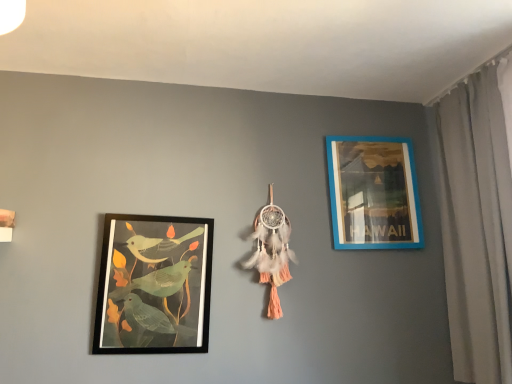
Question: From the image's perspective, is white fabric curtain at right on top of blue plastic picture frame at upper right, arranged as the first picture frame when viewed from the right?

Choices:
 (A) no
 (B) yes

Answer: (A)

Question: Is white fabric curtain at right facing away from blue plastic picture frame at upper right, which appears as the first picture frame when viewed from the back?

Choices:
 (A) no
 (B) yes

Answer: (A)

Question: Can you confirm if white fabric curtain at right is bigger than blue plastic picture frame at upper right, arranged as the first picture frame when viewed from the right?

Choices:
 (A) yes
 (B) no

Answer: (A)

Question: Is white fabric curtain at right far from blue plastic picture frame at upper right, which is counted as the 2th picture frame, starting from the left?

Choices:
 (A) yes
 (B) no

Answer: (B)

Question: Considering the relative sizes of white fabric curtain at right and blue plastic picture frame at upper right, which is counted as the 2th picture frame, starting from the left, in the image provided, is white fabric curtain at right thinner than blue plastic picture frame at upper right, which is counted as the 2th picture frame, starting from the left,?

Choices:
 (A) no
 (B) yes

Answer: (A)

Question: Can you confirm if white fabric curtain at right is taller than blue plastic picture frame at upper right, which appears as the first picture frame when viewed from the back?

Choices:
 (A) no
 (B) yes

Answer: (B)

Question: From the image's perspective, is blue plastic picture frame at upper right, arranged as the first picture frame when viewed from the right, located beneath matte black picture frame at left, which ranks as the first picture frame in front-to-back order?

Choices:
 (A) no
 (B) yes

Answer: (A)

Question: Is blue plastic picture frame at upper right, arranged as the first picture frame when viewed from the right, wider than matte black picture frame at left, the second picture frame in the back-to-front sequence?

Choices:
 (A) yes
 (B) no

Answer: (B)

Question: Is blue plastic picture frame at upper right, which is counted as the 2th picture frame, starting from the left, far from matte black picture frame at left, which ranks as the first picture frame in front-to-back order?

Choices:
 (A) no
 (B) yes

Answer: (A)

Question: Can you confirm if blue plastic picture frame at upper right, which appears as the first picture frame when viewed from the back, is taller than matte black picture frame at left, the second picture frame in the back-to-front sequence?

Choices:
 (A) yes
 (B) no

Answer: (B)

Question: Is blue plastic picture frame at upper right, the 2th picture frame positioned from the front, in front of matte black picture frame at left, the first picture frame viewed from the left?

Choices:
 (A) no
 (B) yes

Answer: (A)

Question: Is blue plastic picture frame at upper right, arranged as the first picture frame when viewed from the right, outside of matte black picture frame at left, the first picture frame viewed from the left?

Choices:
 (A) yes
 (B) no

Answer: (A)

Question: Is matte black picture frame at left, the first picture frame viewed from the left, smaller than blue plastic picture frame at upper right, which is counted as the 2th picture frame, starting from the left?

Choices:
 (A) no
 (B) yes

Answer: (A)